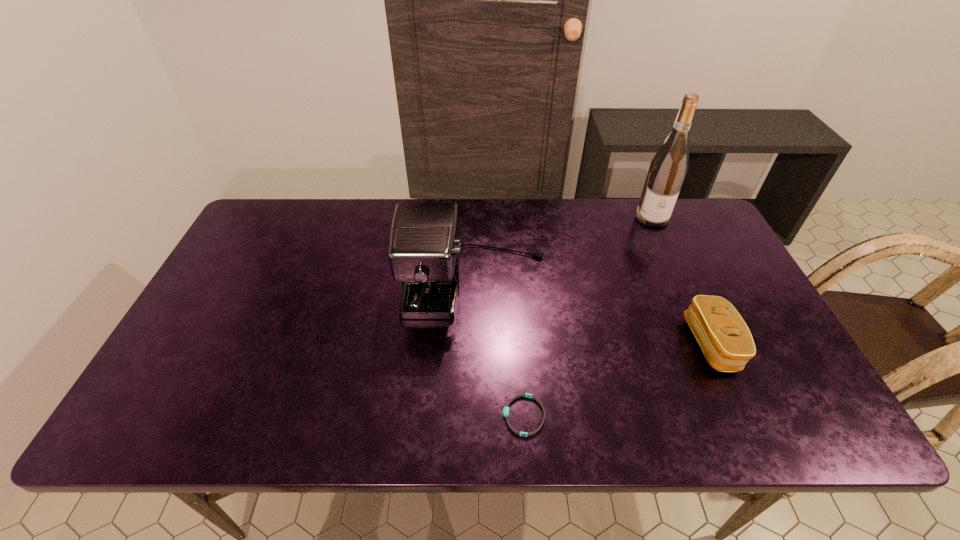
The width and height of the screenshot is (960, 540). What are the coordinates of `vacant position at the near edge of the desktop` in the screenshot? It's located at (230, 413).

The width and height of the screenshot is (960, 540). In the image, there is a desktop. In order to click on free space at the left edge in this screenshot , I will do tap(245, 303).

I want to click on free space at the right edge of the desktop, so click(688, 288).

At what (x,y) coordinates should I click in order to perform the action: click on vacant space at the far left corner of the desktop. Please return your answer as a coordinate pair (x, y). Looking at the image, I should click on (258, 240).

At what (x,y) coordinates should I click in order to perform the action: click on vacant space in between the coffee maker and the clutch bag. Please return your answer as a coordinate pair (x, y). Looking at the image, I should click on (593, 316).

Find the location of `free point between the nearest object and the tallest object`. free point between the nearest object and the tallest object is located at coordinates (588, 316).

This screenshot has height=540, width=960. Identify the location of unoccupied position between the wine bottle and the second tallest object. (564, 252).

In order to click on free spot between the nearest object and the clutch bag in this screenshot , I will do `click(617, 380)`.

I want to click on vacant space that's between the tallest object and the third tallest object, so click(x=682, y=280).

In order to click on unoccupied area between the farthest object and the shortest object in this screenshot , I will do `click(588, 316)`.